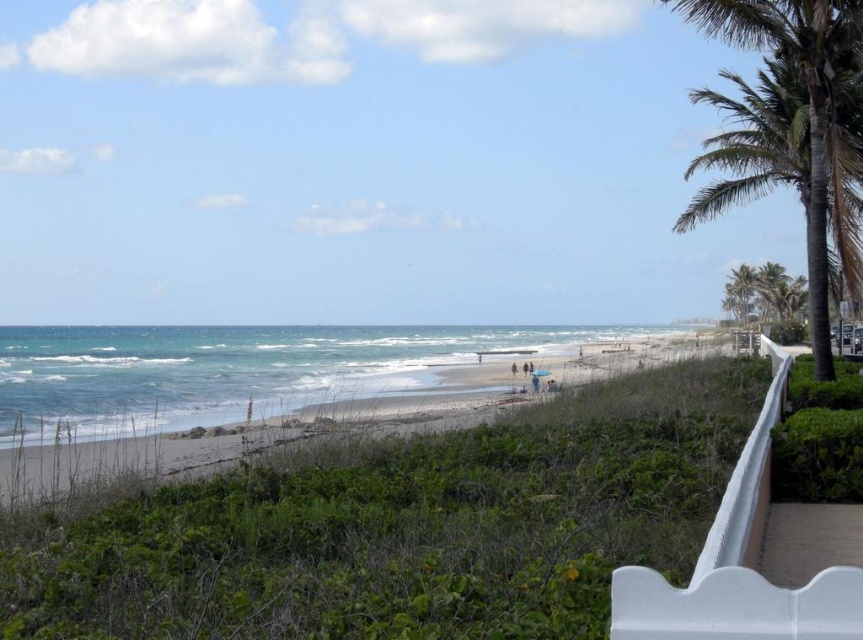
Looking at this image, does sandy beach at center appear over green leafy palm tree at right?

Actually, sandy beach at center is below green leafy palm tree at right.

Which is in front, point (684, 332) or point (760, 12)?

Point (760, 12) is in front.

The height and width of the screenshot is (640, 863). What do you see at coordinates (263, 392) in the screenshot?
I see `sandy beach at center` at bounding box center [263, 392].

I want to click on sandy beach at center, so click(x=263, y=392).

Is sandy beach at center to the right of white plastic balustrade at right from the viewer's perspective?

No, sandy beach at center is not to the right of white plastic balustrade at right.

In the scene shown: Does sandy beach at center lie behind white plastic balustrade at right?

Yes, sandy beach at center is further from the viewer.

Between point (67, 438) and point (723, 609), which one is positioned in front?

Point (723, 609) is in front.

The width and height of the screenshot is (863, 640). Identify the location of sandy beach at center. (x=263, y=392).

Is point (832, 630) more distant than point (700, 3)?

No, (832, 630) is closer to viewer.

Between white plastic balustrade at right and green leafy palm tree at right, which one is positioned lower?

white plastic balustrade at right is below.

This screenshot has width=863, height=640. What do you see at coordinates (739, 564) in the screenshot?
I see `white plastic balustrade at right` at bounding box center [739, 564].

I want to click on white plastic balustrade at right, so click(x=739, y=564).